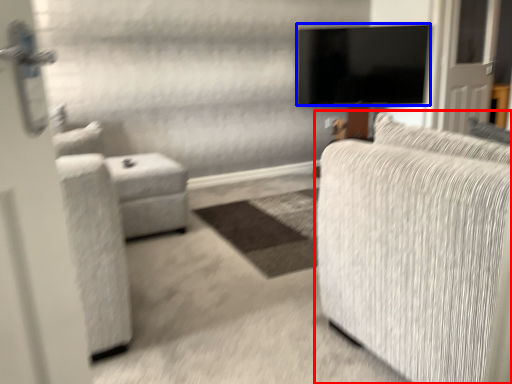
Question: Which point is closer to the camera, studio couch (highlighted by a red box) or television (highlighted by a blue box)?

Choices:
 (A) studio couch
 (B) television

Answer: (A)